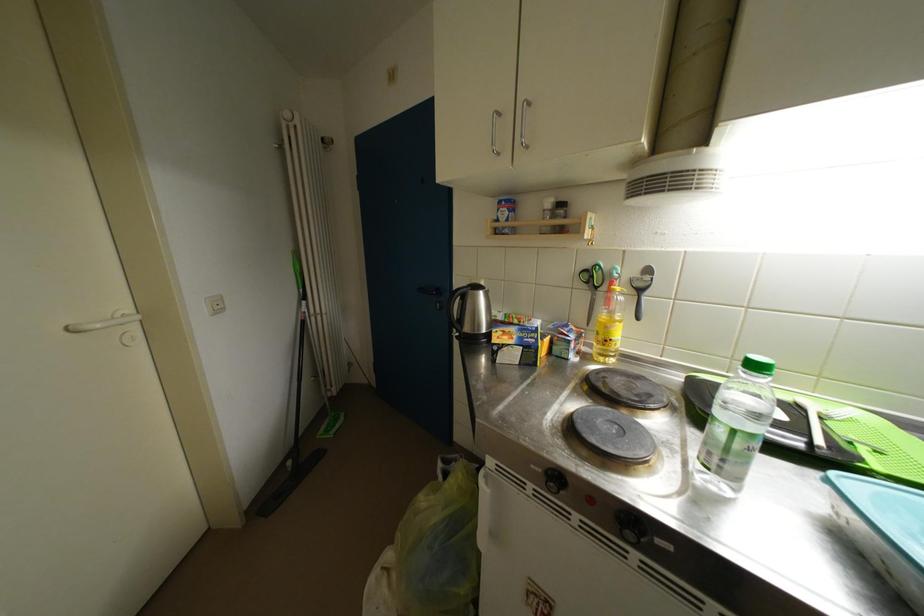
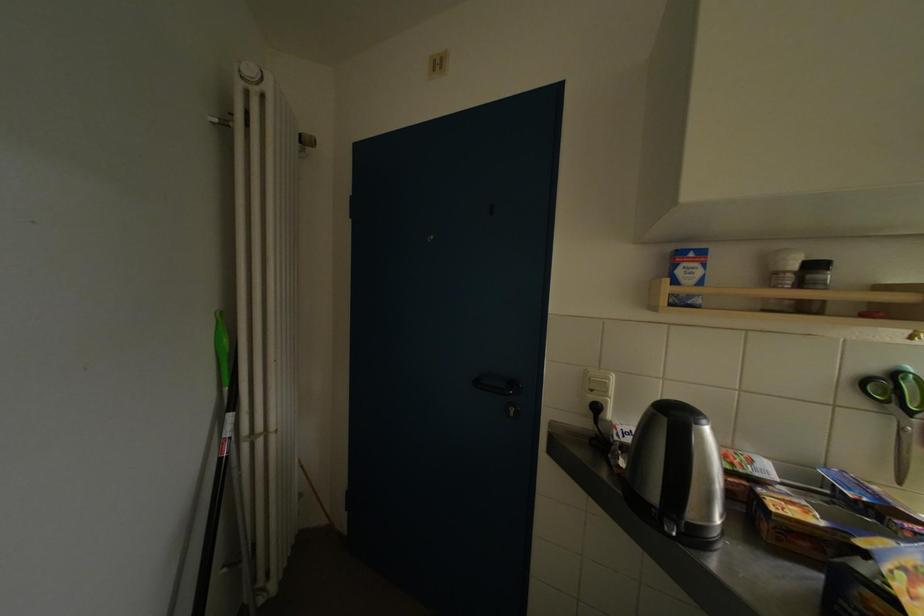
Find the pixel in the second image that matches (x=505, y=217) in the first image.

(686, 276)